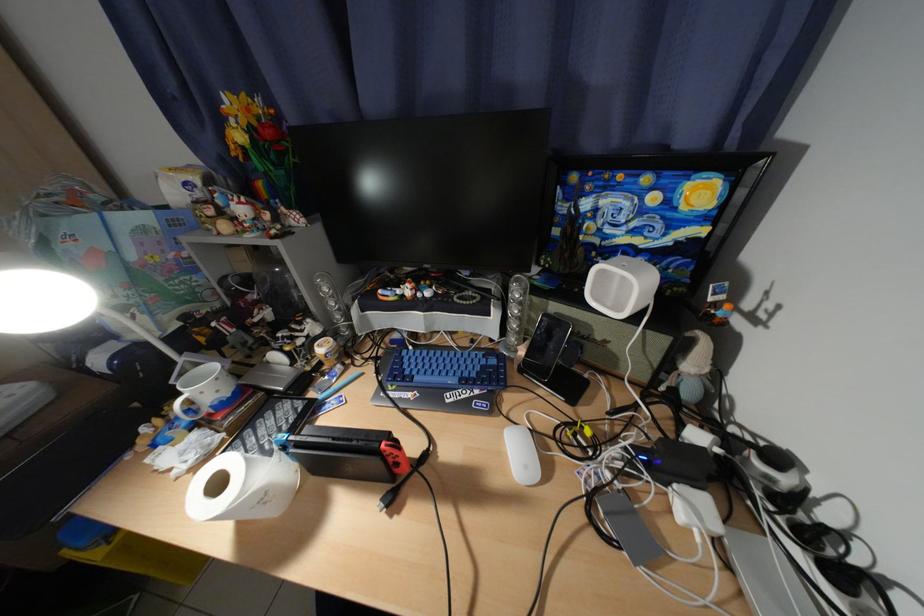
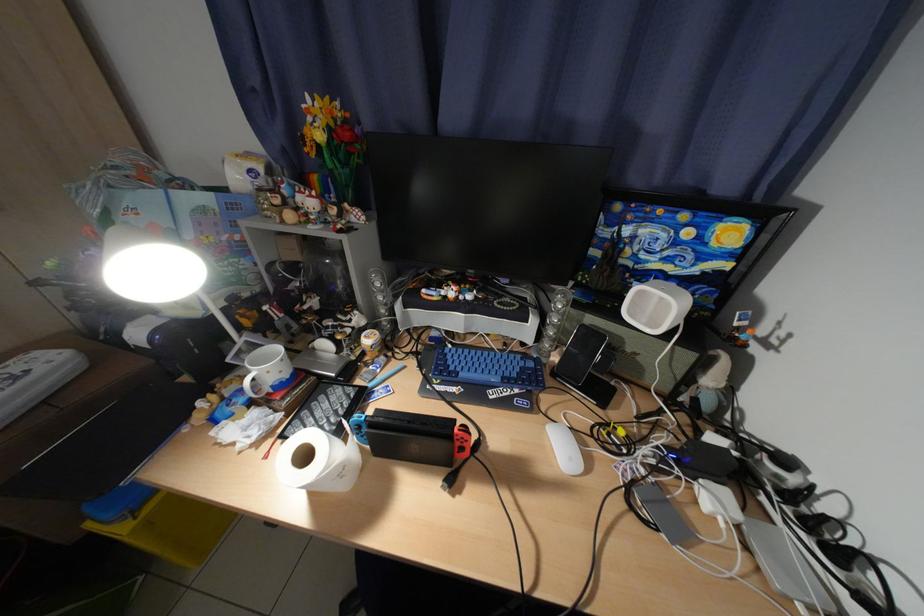
In the second image, find the point that corresponds to [251,139] in the first image.

(331, 138)